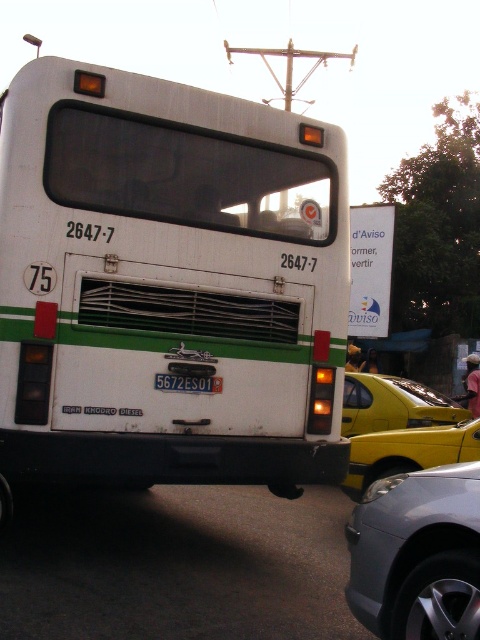
You are a passenger on the white bus with green accents. You notice two points marked on the bus window. The first point is at coordinates point (35, 333) and the second point is at point (435, 589). From your seat inside the bus, which point would appear closer to the front of the bus?

Point (435, 589) would appear closer to the front of the bus because it is in front of point (35, 333).

You are a pedestrian standing on the sidewalk and see both the white matte bus at center and the yellow matte taxi at center. Which one is closer to the right side of the road?

The yellow matte taxi at center is closer to the right side of the road because the white matte bus at center is to the left of it.